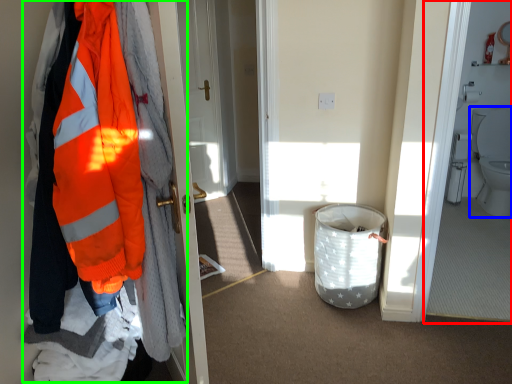
Question: Which object is the closest to the corridor (highlighted by a red box)? Choose among these: toilet (highlighted by a blue box) or jacket (highlighted by a green box).

Choices:
 (A) toilet
 (B) jacket

Answer: (A)